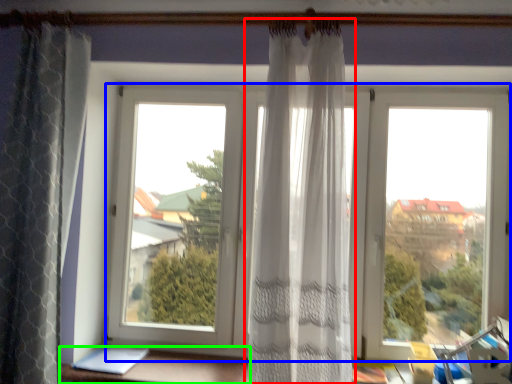
Question: Which object is positioned farthest from curtain (highlighted by a red box)? Select from window (highlighted by a blue box) and furniture (highlighted by a green box).

Choices:
 (A) window
 (B) furniture

Answer: (B)